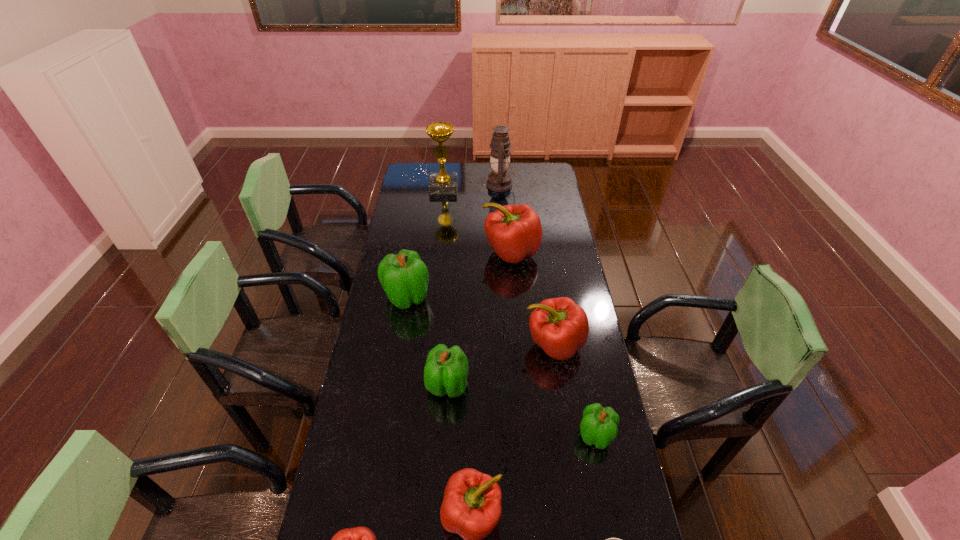
Identify the location of the rightmost green bell pepper. This screenshot has width=960, height=540. (598, 426).

You are a GUI agent. You are given a task and a screenshot of the screen. Output one action in this format:
    pyautogui.click(x=<x>, y=<y>)
    Task: Click on the blank space located on the right of the blue oil lamp
    This screenshot has width=960, height=540.
    Given the screenshot: What is the action you would take?
    pyautogui.click(x=558, y=185)

The width and height of the screenshot is (960, 540). I want to click on vacant space located 0.140m on the front-facing side of the gold award, so click(x=442, y=210).

Locate an element on the screen. This screenshot has width=960, height=540. vacant space located on the back of the eighth nearest object is located at coordinates (506, 194).

Locate an element on the screen. free point located 0.070m on the right of the second farthest bell pepper is located at coordinates (448, 297).

Identify the location of vacant area situated on the left of the second farthest pink bell pepper. (475, 345).

Identify the location of vacant space located 0.080m on the front of the second smallest green bell pepper. (445, 428).

Identify the location of vacant space located 0.220m on the left of the smallest green bell pepper. (506, 435).

I want to click on oil lamp that is positioned at the far edge, so click(499, 180).

Where is `award situated at the far edge`? award situated at the far edge is located at coordinates (442, 182).